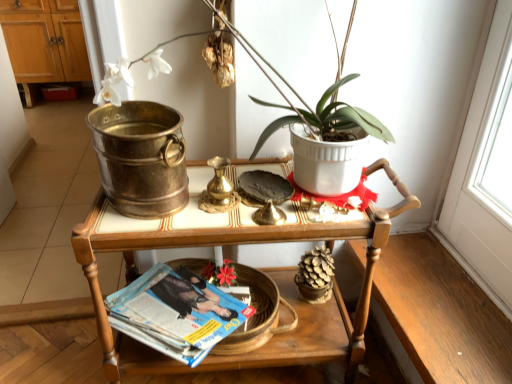
Locate an element on the screen. vacant space underneath white ceramic pot at upper center (from a real-world perspective) is located at coordinates (253, 175).